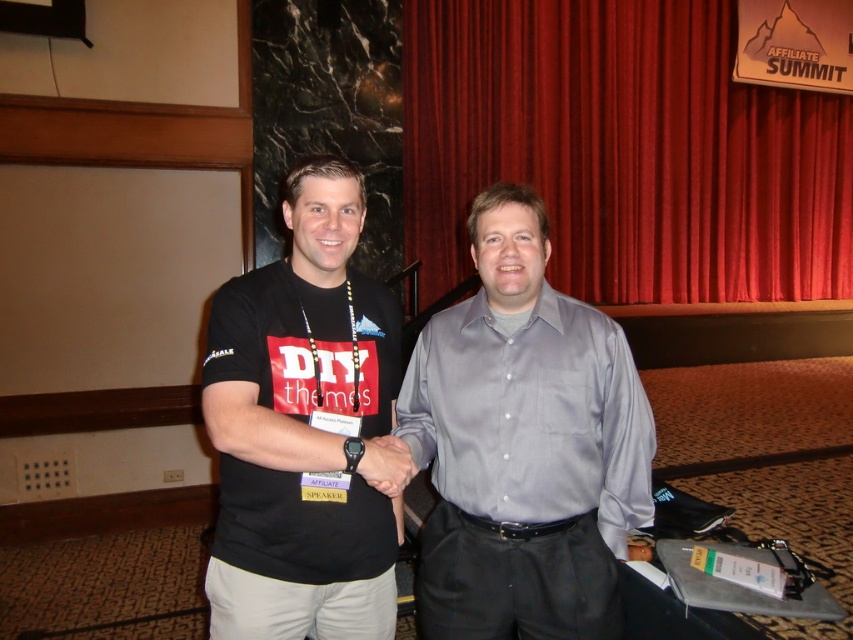
You are an event planner organizing a photoshoot for the conference. You need to position a spotlight at point (524, 444). Which person should you expect the spotlight to illuminate?

The spotlight at point (524, 444) will illuminate the gray satin shirt at center, as the object description states that this point corresponds to the location of the gray satin shirt at center.